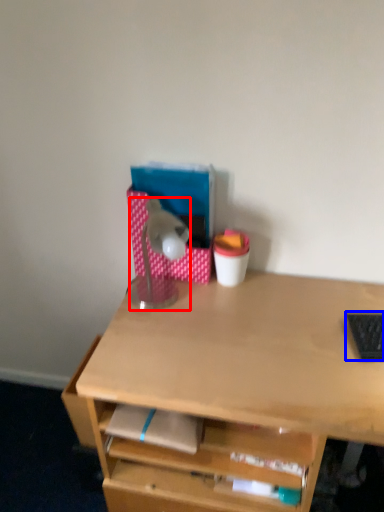
Question: Which of the following is the farthest to the observer, lamp (highlighted by a red box) or laptop keyboard (highlighted by a blue box)?

Choices:
 (A) lamp
 (B) laptop keyboard

Answer: (A)